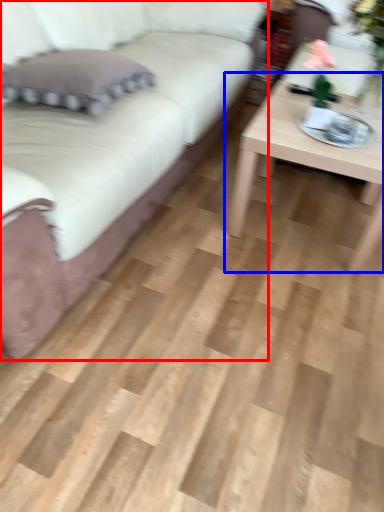
Question: Which object appears farthest to the camera in this image, studio couch (highlighted by a red box) or coffee table (highlighted by a blue box)?

Choices:
 (A) studio couch
 (B) coffee table

Answer: (B)